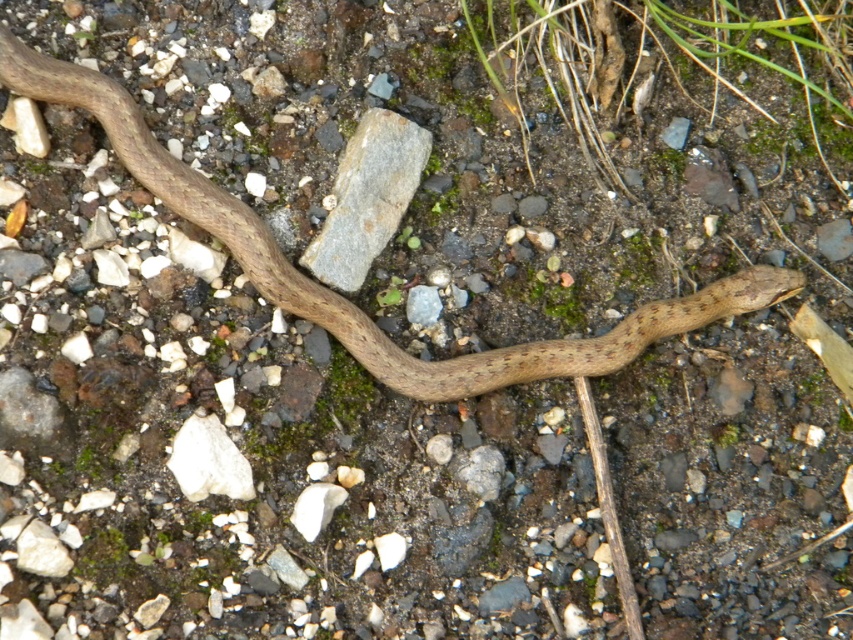
You are a hiker who spots the brown matte snake at center and the white matte rock at lower left in the image. From your perspective, which object is positioned more to the right?

The brown matte snake at center is positioned more to the right than the white matte rock at lower left.

You are a wildlife photographer aiming to capture a closeup shot of the brown matte snake at center. You need to position your camera 10 inches away from the snake to get the best focus. However, there is a gray rock at center in the way. Is the snake currently positioned within the required distance for your shot without moving the rock?

The distance between the brown matte snake at center and the gray rock at center is 7.60 inches. Since the required distance for the camera is 10 inches, the snake is within the required distance, so you can take the photo without moving the rock.

Where is the brown matte snake at center located in the image?

The brown matte snake at center is located at point (341, 296) in the image.